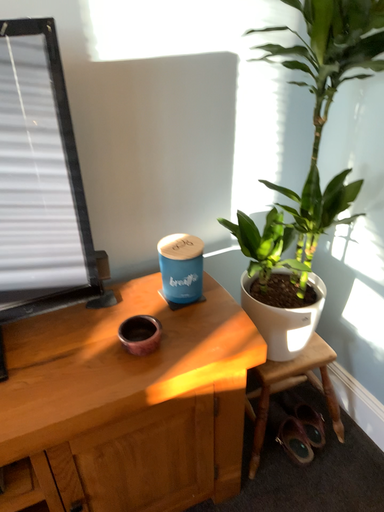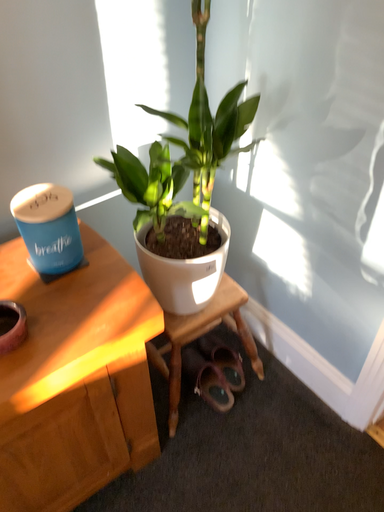
Question: How did the camera likely rotate when shooting the video?

Choices:
 (A) rotated right
 (B) rotated left

Answer: (A)